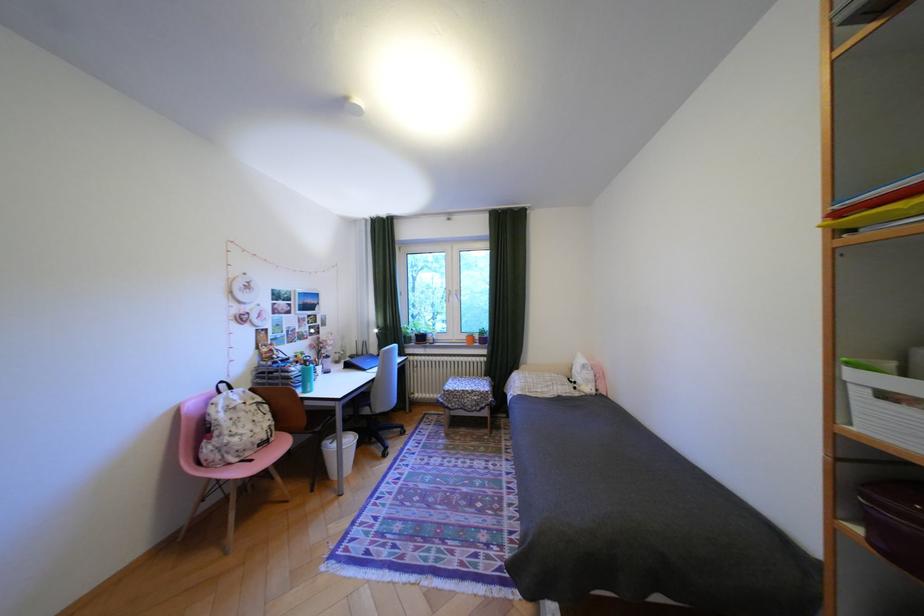
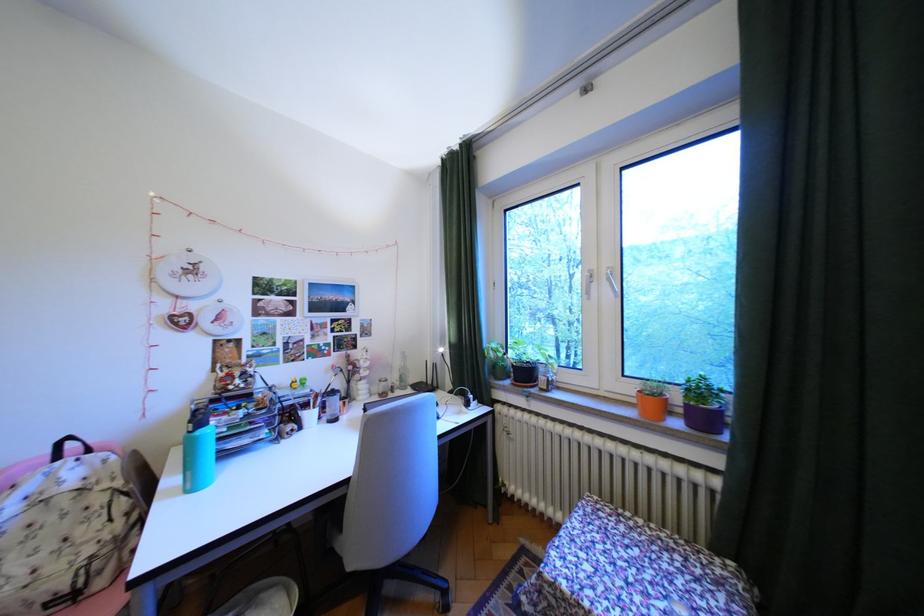
Where in the second image is the point corresponding to the point at 384,379 from the first image?

(359, 483)